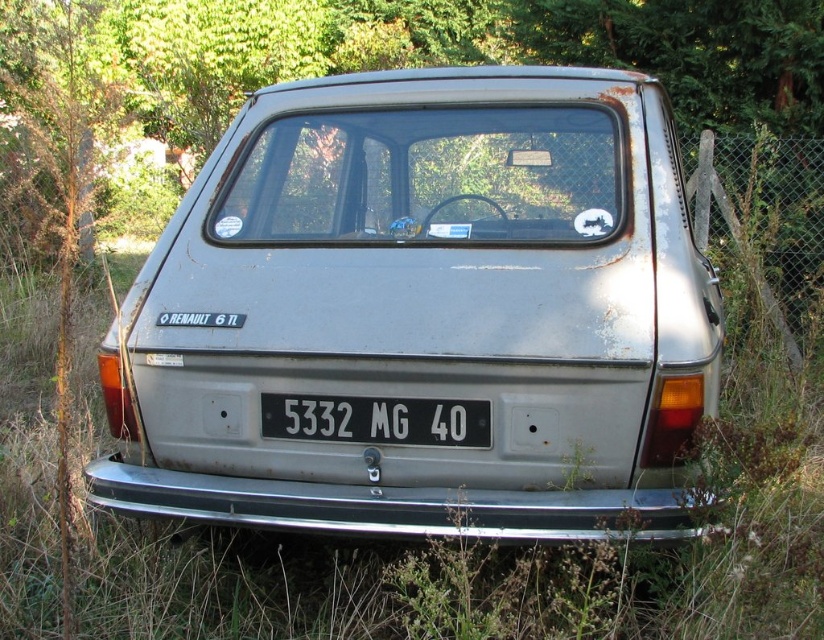
Is rusty metal car at center bigger than white plastic license plate at center?

Indeed, rusty metal car at center has a larger size compared to white plastic license plate at center.

Does point (602, 384) come closer to viewer compared to point (322, 435)?

Yes, point (602, 384) is in front of point (322, 435).

Image resolution: width=824 pixels, height=640 pixels. I want to click on rusty metal car at center, so click(424, 308).